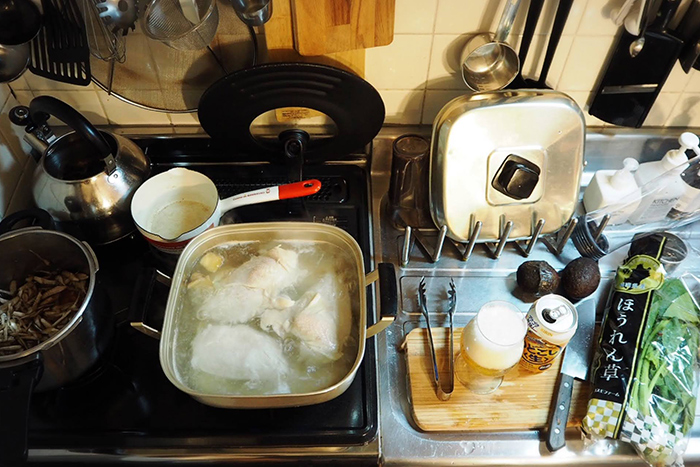
Where is `stove`? This screenshot has width=700, height=467. stove is located at coordinates (140, 424).